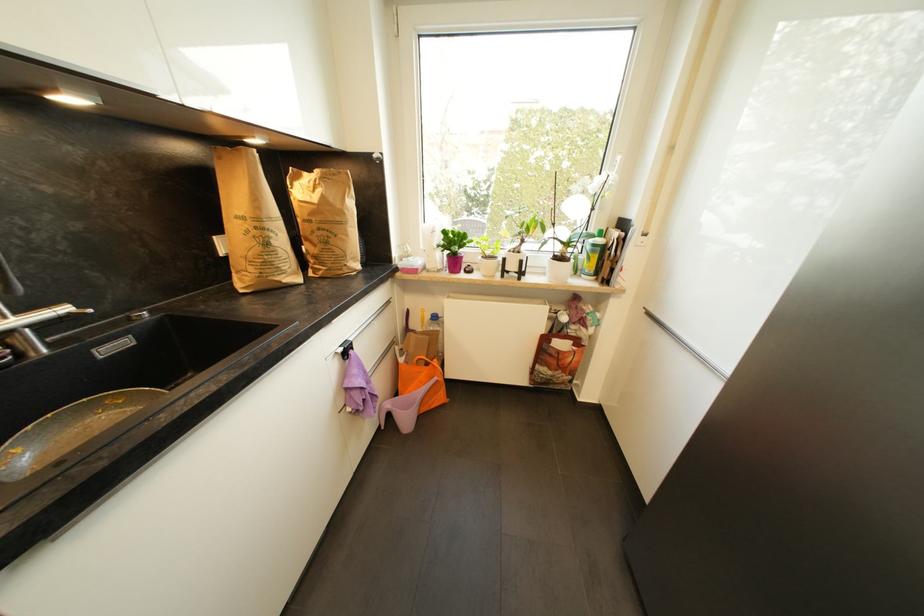
Locate an element on the screen. green spray bottle is located at coordinates (592, 254).